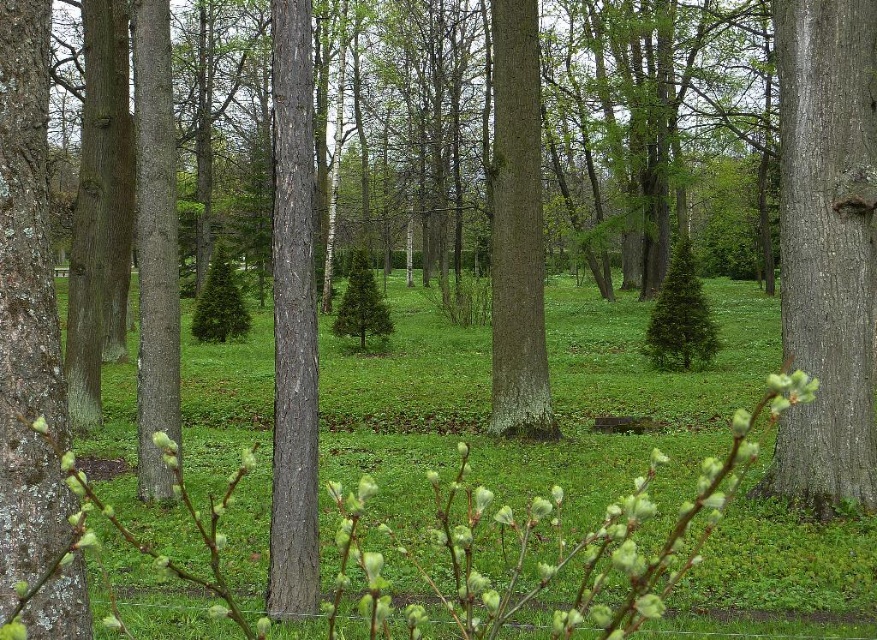
Looking at this image, can you confirm if lichen-covered bark tree trunk at left is thinner than smooth bark tree trunk at center?

Yes, lichen-covered bark tree trunk at left is thinner than smooth bark tree trunk at center.

Consider the image. Is lichen-covered bark tree trunk at left closer to camera compared to smooth bark tree trunk at center?

Yes, it is.

Which is in front, point (30, 609) or point (496, 216)?

Positioned in front is point (30, 609).

Identify the location of lichen-covered bark tree trunk at left. This screenshot has height=640, width=877. (26, 308).

How much distance is there between green grassy at center and smooth bark tree trunk at right?

The distance of green grassy at center from smooth bark tree trunk at right is 8.68 meters.

Does green grassy at center have a lesser width compared to smooth bark tree trunk at right?

Incorrect, green grassy at center's width is not less than smooth bark tree trunk at right's.

At what (x,y) coordinates should I click in order to perform the action: click on green grassy at center. Please return your answer as a coordinate pair (x, y). This screenshot has width=877, height=640. Looking at the image, I should click on (553, 396).

Where is `green grassy at center`? green grassy at center is located at coordinates (553, 396).

Is green grassy at center to the right of smooth bark tree trunk at center from the viewer's perspective?

Incorrect, green grassy at center is not on the right side of smooth bark tree trunk at center.

This screenshot has width=877, height=640. In order to click on green grassy at center in this screenshot , I will do `click(553, 396)`.